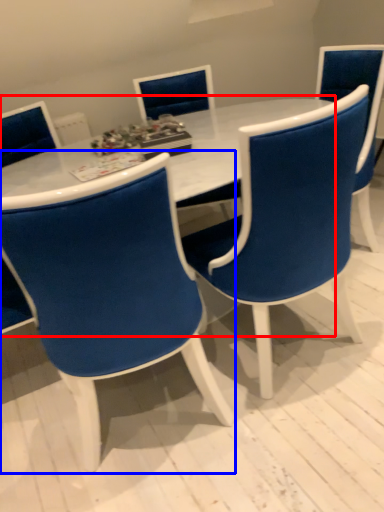
Question: Which of the following is the closest to the observer, table (highlighted by a red box) or chair (highlighted by a blue box)?

Choices:
 (A) table
 (B) chair

Answer: (B)